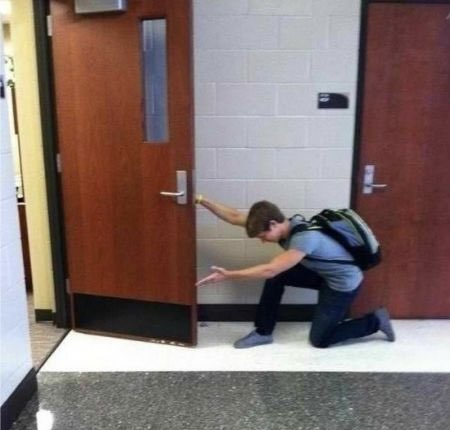
The height and width of the screenshot is (430, 450). I want to click on white part of floor, so click(296, 354).